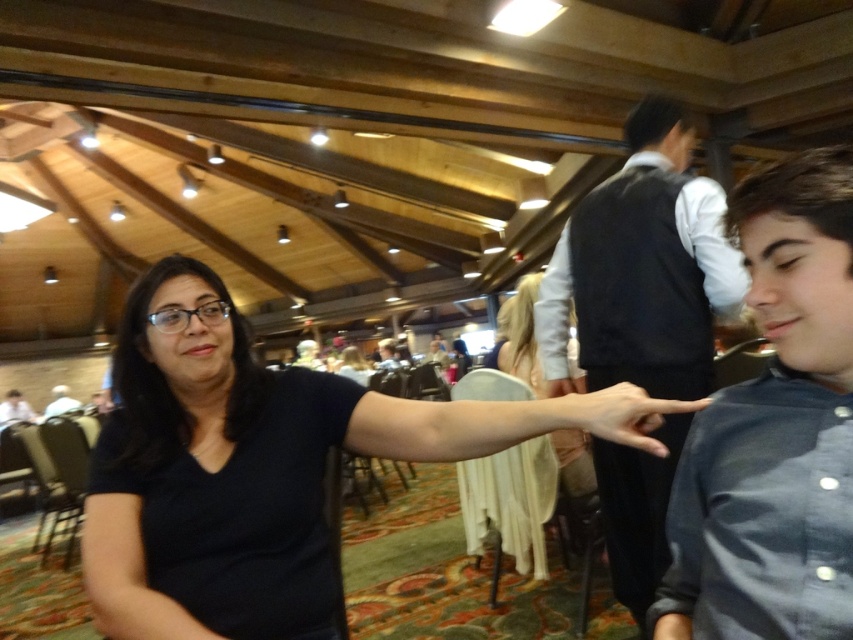
You are at a social event and notice two items in the scene described. The first is the black matte shirt at center, and the second is the white fabric at upper left. Which of these two items is positioned higher up in the image?

The black matte shirt at center is taller than the white fabric at upper left, so the black matte shirt at center is positioned higher up in the image.

You are standing in the venue and see two points marked in the image. Which point, point (x=831, y=481) or point (x=624, y=408), is closer to you?

Point (x=831, y=481) is closer to the camera than point (x=624, y=408), so it is closer to you.

Consider the image. You are a photographer setting up a shot in this venue. You want to frame the blue denim shirt at right and the matte skin hand at center in your photo. Which object is wider in the image?

The blue denim shirt at right is wider than the matte skin hand at center, as stated in the objects description.